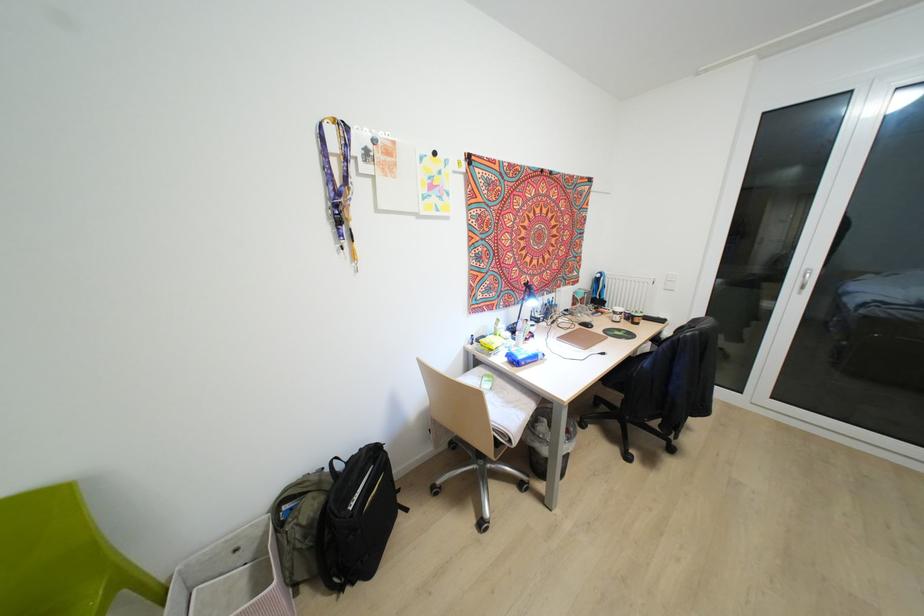
The location [299,525] corresponds to which object?

It corresponds to the green backpack in the image.